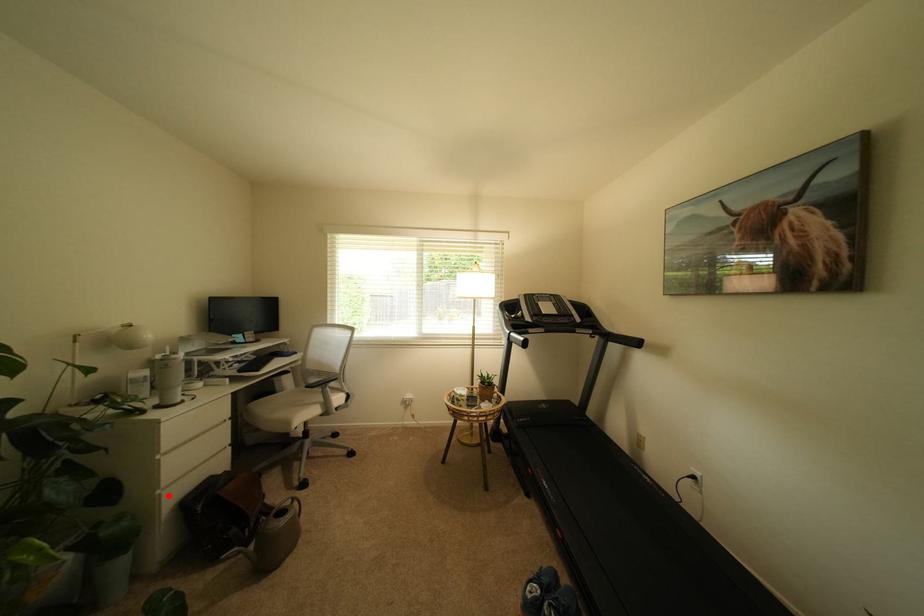
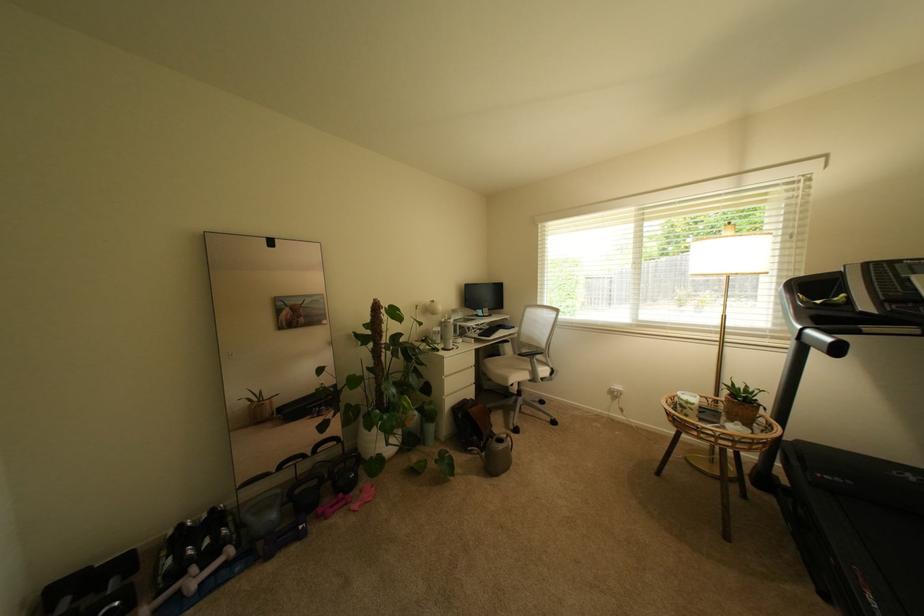
Question: I am providing you with two images of the same scene from different viewpoints. A red point is shown in image1. For the corresponding object point in image2, is it positioned nearer or farther from the camera?

Choices:
 (A) Nearer
 (B) Farther

Answer: (B)